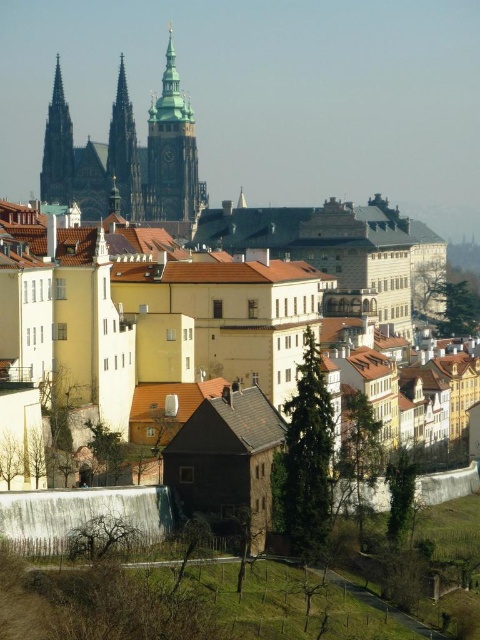
You are an architect analyzing the cityscape. You need to determine if the golden stone spire at center can accommodate a wider decorative element compared to the smooth stone spire at upper left. Based on the image, what can you conclude?

The golden stone spire at center might be wider than smooth stone spire at upper left, so it can accommodate a wider decorative element compared to the smooth stone spire at upper left.

You are standing in the historic cityscape of Prague and want to determine which of the two points, point (157, 104) or point (68, 164), is closer to you. Based on the perspective, which point is nearer?

Point (157, 104) is closer to you because it is further to the viewer compared to point (68, 164).

You are an architect analyzing the city layout. You notice the golden stone tower at center and the golden stone spire at center. Which one appears to be closer to the front of the image?

The golden stone tower at center is positioned over the golden stone spire at center, so the tower is closer to the front of the image.